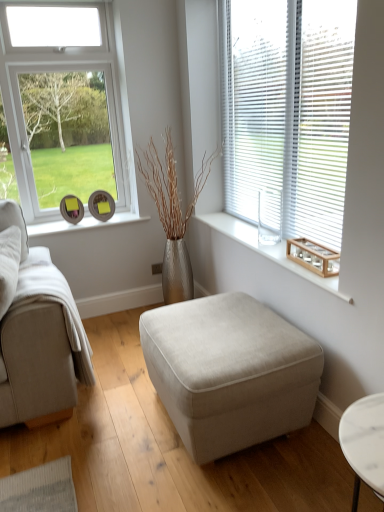
The width and height of the screenshot is (384, 512). In order to click on vacant space that is to the left of beige fabric ottoman at center in this screenshot , I will do `click(100, 435)`.